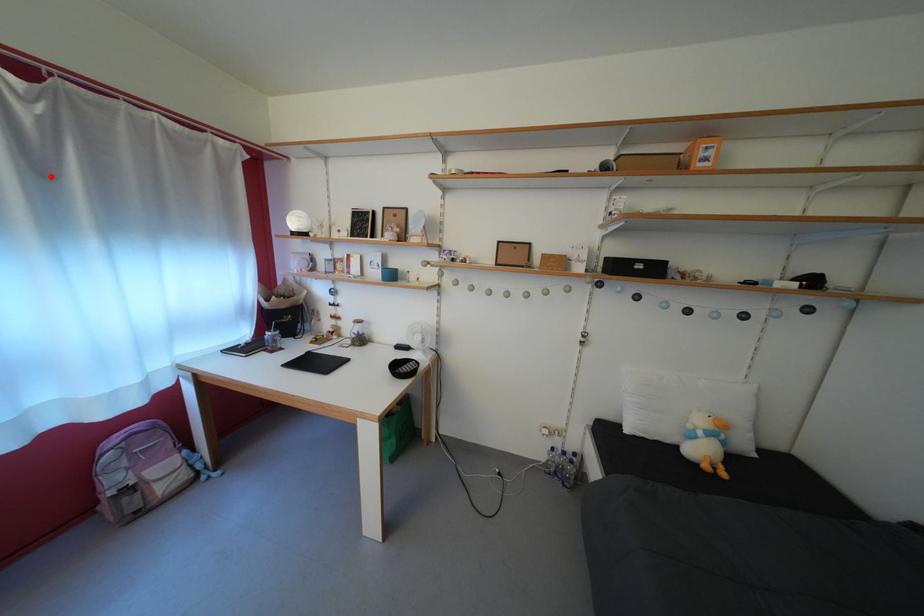
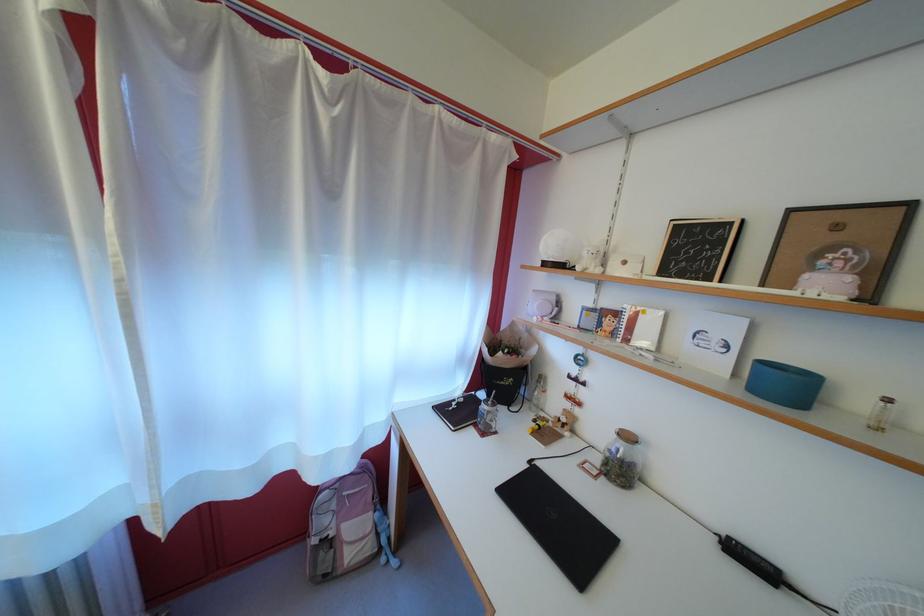
In the second image, find the point that corresponds to the highlighted location in the first image.

(335, 193)